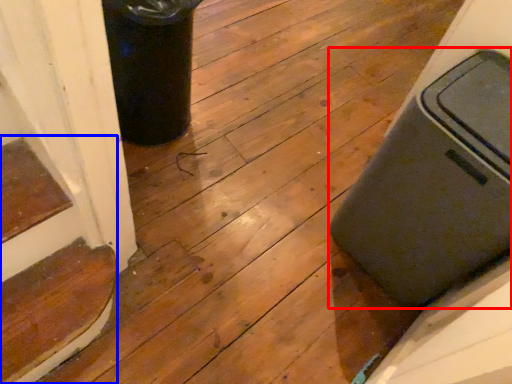
Question: Which object is further to the camera taking this photo, waste container (highlighted by a red box) or stairwell (highlighted by a blue box)?

Choices:
 (A) waste container
 (B) stairwell

Answer: (B)